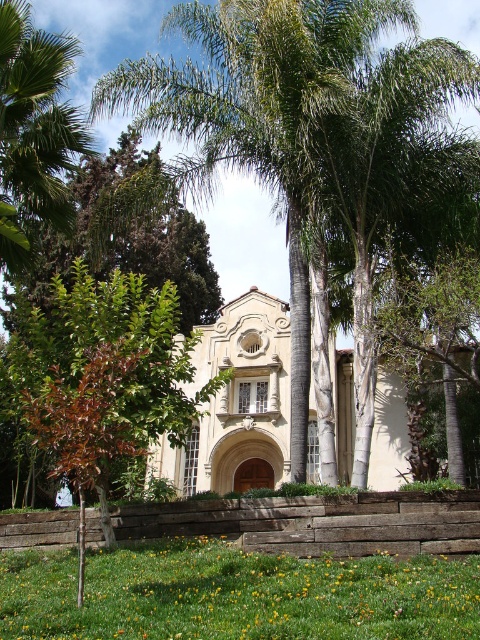
Question: Does green grass at lower center appear on the left side of green leafy palm tree at left?

Choices:
 (A) no
 (B) yes

Answer: (A)

Question: Considering the real-world distances, which object is closest to the green grass at lower center?

Choices:
 (A) green leafy palm tree at left
 (B) beige stone chapel at center
 (C) green leafy palm tree at center

Answer: (C)

Question: Among these points, which one is farthest from the camera?

Choices:
 (A) (326, 147)
 (B) (361, 625)
 (C) (63, 216)
 (D) (154, 461)

Answer: (D)

Question: Does green leafy palm tree at center have a greater width compared to green grass at lower center?

Choices:
 (A) yes
 (B) no

Answer: (A)

Question: Which point is closer to the camera?

Choices:
 (A) (302, 58)
 (B) (247, 404)
 (C) (71, 129)

Answer: (A)

Question: Is green leafy palm tree at center above green leafy palm tree at left?

Choices:
 (A) no
 (B) yes

Answer: (B)